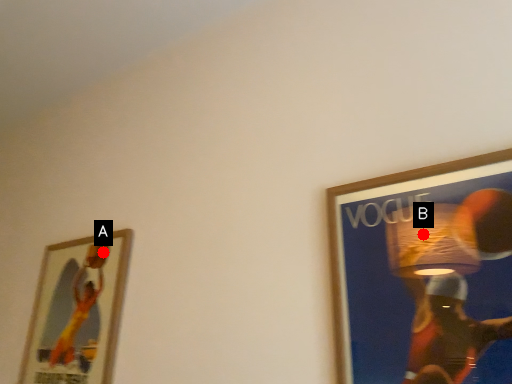
Question: Two points are circled on the image, labeled by A and B beside each circle. Which of the following is the farthest from the observer?

Choices:
 (A) A is further
 (B) B is further

Answer: (A)